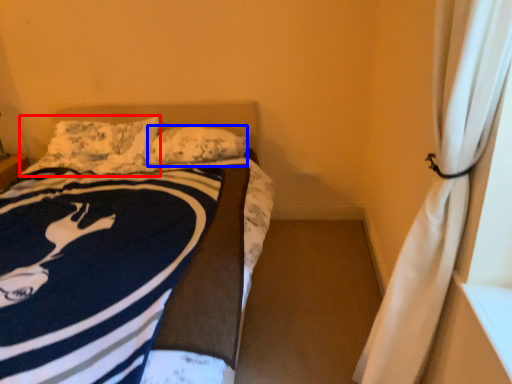
Question: Which object is further to the camera taking this photo, pillow (highlighted by a red box) or pillow (highlighted by a blue box)?

Choices:
 (A) pillow
 (B) pillow

Answer: (A)